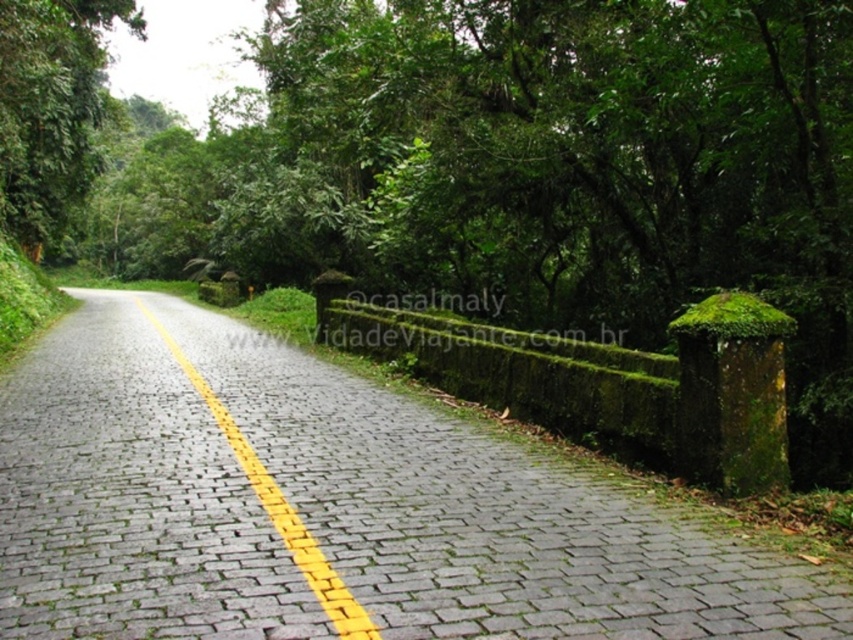
What do you see at coordinates (332, 508) in the screenshot? This screenshot has height=640, width=853. I see `gray cobblestone road at center` at bounding box center [332, 508].

Who is taller, gray cobblestone road at center or yellowsmoothline at center?

yellowsmoothline at center is taller.

Does point (312, 452) come behind point (247, 460)?

Yes, it is.

You are a GUI agent. You are given a task and a screenshot of the screen. Output one action in this format:
    pyautogui.click(x=<x>, y=<y>)
    Task: Click on the gray cobblestone road at center
    
    Given the screenshot: What is the action you would take?
    pyautogui.click(x=332, y=508)

Between gray cobblestone road at center and mossy stone hedge at right, which one appears on the right side from the viewer's perspective?

mossy stone hedge at right

Who is shorter, gray cobblestone road at center or mossy stone hedge at right?

gray cobblestone road at center is shorter.

What are the coordinates of `gray cobblestone road at center` in the screenshot? It's located at (332, 508).

Who is positioned more to the left, gray cobblestone road at center or green leafy tree at left?

Positioned to the left is green leafy tree at left.

Is point (637, 541) positioned in front of point (57, 115)?

Yes, it is in front of point (57, 115).

The height and width of the screenshot is (640, 853). What do you see at coordinates (332, 508) in the screenshot?
I see `gray cobblestone road at center` at bounding box center [332, 508].

The width and height of the screenshot is (853, 640). In order to click on gray cobblestone road at center in this screenshot , I will do `click(332, 508)`.